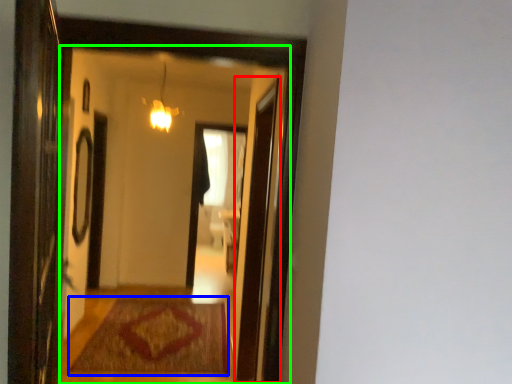
Question: Which object is the farthest from screen door (highlighted by a red box)? Choose among these: mat (highlighted by a blue box) or mirror (highlighted by a green box).

Choices:
 (A) mat
 (B) mirror

Answer: (B)